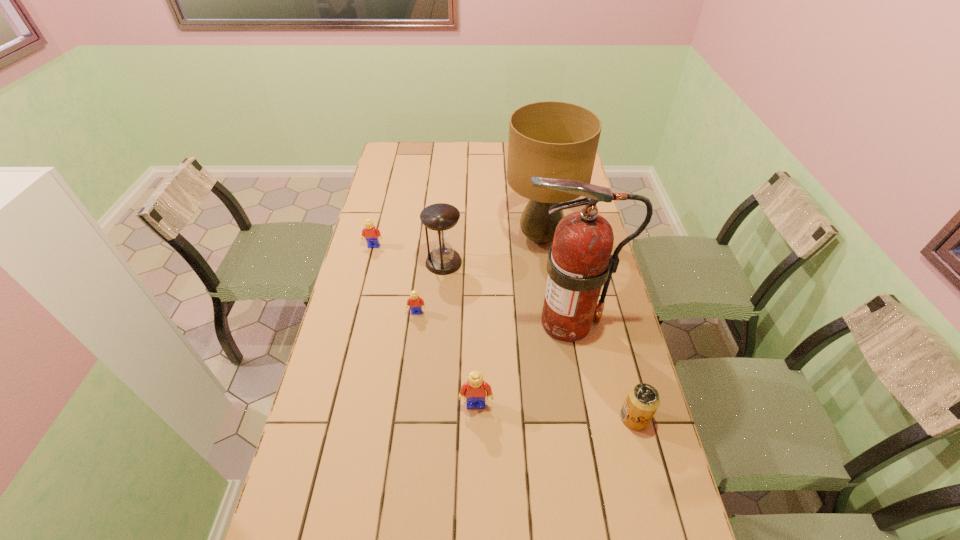
Image resolution: width=960 pixels, height=540 pixels. I want to click on free space that satisfies the following two spatial constraints: 1. at the nozzle of the beer can; 2. on the right side of the fire extinguisher, so click(x=583, y=417).

This screenshot has height=540, width=960. What are the coordinates of `vacant position in the image that satisfies the following two spatial constraints: 1. on the back side of the lampshade; 2. on the left side of the hourglass` in the screenshot? It's located at (445, 238).

The image size is (960, 540). Find the location of `vacant space that satisfies the following two spatial constraints: 1. on the front side of the lampshade; 2. on the right side of the beer can`. vacant space that satisfies the following two spatial constraints: 1. on the front side of the lampshade; 2. on the right side of the beer can is located at coordinates (566, 417).